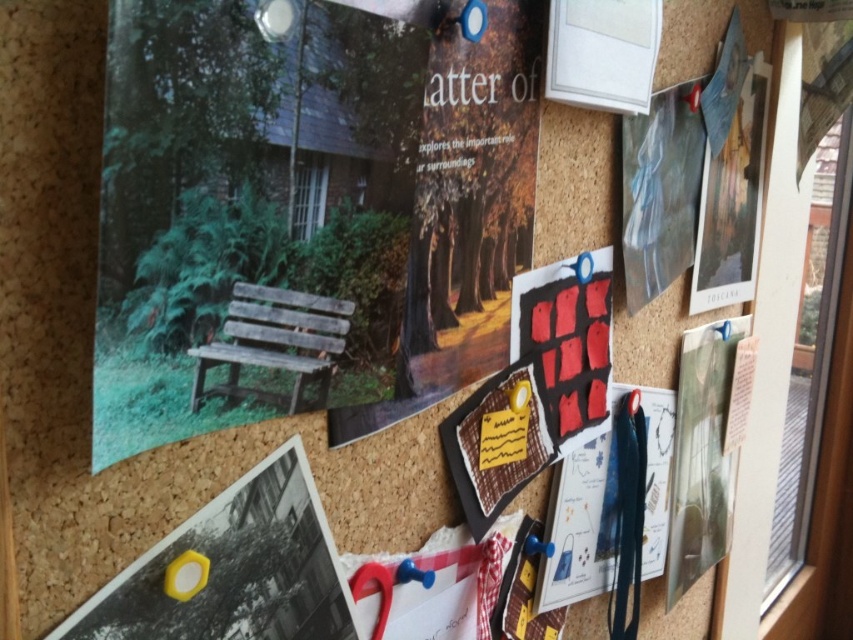
Question: Estimate the real-world distances between objects in this image. Which object is closer to the yellow plastic hexagon at lower left?

Choices:
 (A) matte red poster at center right
 (B) wooden bench at upper left

Answer: (B)

Question: Is wooden bench at upper left positioned in front of yellow plastic hexagon at lower left?

Choices:
 (A) no
 (B) yes

Answer: (B)

Question: Does wooden bench at upper left appear under matte red poster at center right?

Choices:
 (A) no
 (B) yes

Answer: (A)

Question: Where is wooden bench at upper left located in relation to yellow plastic hexagon at lower left in the image?

Choices:
 (A) above
 (B) below

Answer: (A)

Question: Which is nearer to the wooden bench at upper left?

Choices:
 (A) yellow plastic hexagon at lower left
 (B) matte red poster at center right

Answer: (A)

Question: Which of these objects is positioned closest to the wooden bench at upper left?

Choices:
 (A) matte red poster at center right
 (B) yellow plastic hexagon at lower left

Answer: (B)